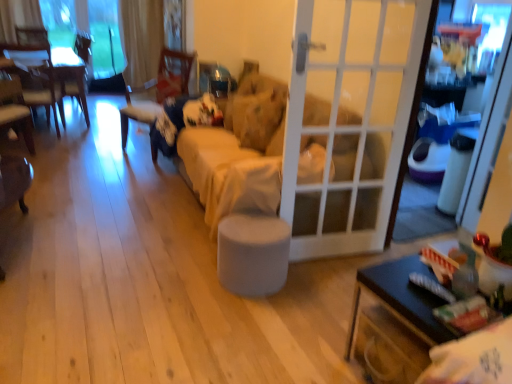
Identify the location of free spot to the right of gray fabric stool at center. The width and height of the screenshot is (512, 384). (302, 285).